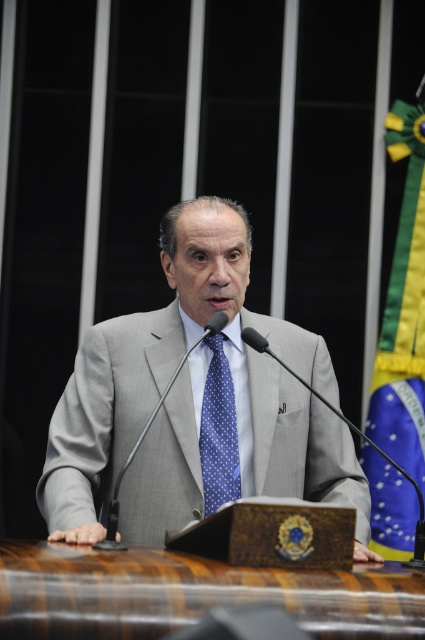
Question: Among these objects, which one is farthest from the camera?

Choices:
 (A) blue fabric flag at right
 (B) gray fabric suit at center

Answer: (A)

Question: Based on their relative distances, which object is farther from the blue fabric flag at right?

Choices:
 (A) blue dotted fabric tie at center
 (B) gray fabric suit at center

Answer: (B)

Question: Is blue fabric flag at right closer to the viewer compared to blue dotted fabric tie at center?

Choices:
 (A) no
 (B) yes

Answer: (A)

Question: Based on their relative distances, which object is farther from the blue fabric flag at right?

Choices:
 (A) blue dotted fabric tie at center
 (B) gray fabric suit at center

Answer: (B)

Question: Does blue fabric flag at right lie in front of blue dotted fabric tie at center?

Choices:
 (A) no
 (B) yes

Answer: (A)

Question: Is gray fabric suit at center above blue dotted fabric tie at center?

Choices:
 (A) no
 (B) yes

Answer: (B)